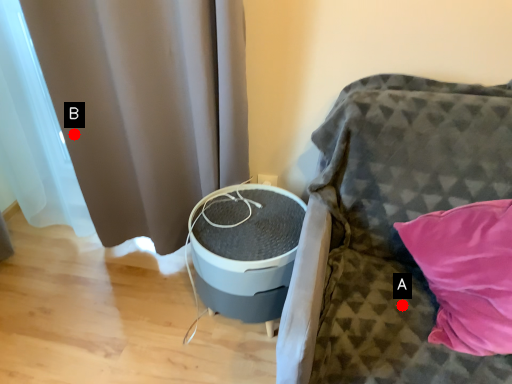
Question: Two points are circled on the image, labeled by A and B beside each circle. Which point appears farthest from the camera in this image?

Choices:
 (A) A is further
 (B) B is further

Answer: (B)